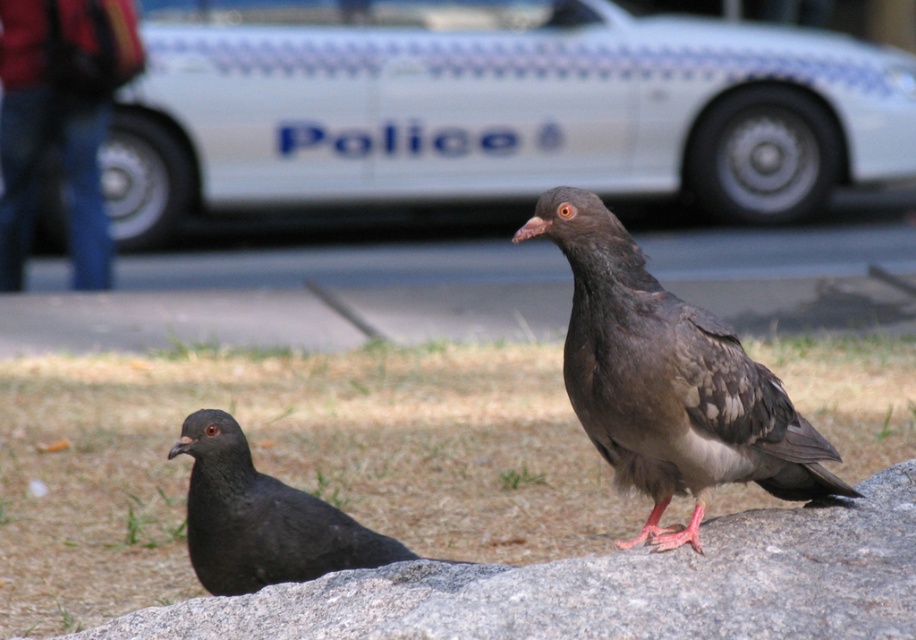
Is gray granite rock at center wider than dark gray feathered pigeon at center?

Indeed, gray granite rock at center has a greater width compared to dark gray feathered pigeon at center.

You are a GUI agent. You are given a task and a screenshot of the screen. Output one action in this format:
    pyautogui.click(x=<x>, y=<y>)
    Task: Click on the gray granite rock at center
    The height and width of the screenshot is (640, 916).
    Given the screenshot: What is the action you would take?
    pyautogui.click(x=608, y=588)

Who is higher up, dark gray feathered pigeon at center or red backpack at upper left?

red backpack at upper left

Is point (698, 365) positioned after point (1, 150)?

That is False.

The image size is (916, 640). I want to click on dark gray feathered pigeon at center, so click(x=668, y=380).

Is red backpack at upper left above matte black pigeon at lower left?

Indeed, red backpack at upper left is positioned over matte black pigeon at lower left.

Between point (75, 86) and point (268, 561), which one is positioned behind?

The point (75, 86) is more distant.

Between point (75, 19) and point (270, 554), which one is positioned behind?

The point (75, 19) is more distant.

Find the location of a particular element. The width and height of the screenshot is (916, 640). red backpack at upper left is located at coordinates (60, 120).